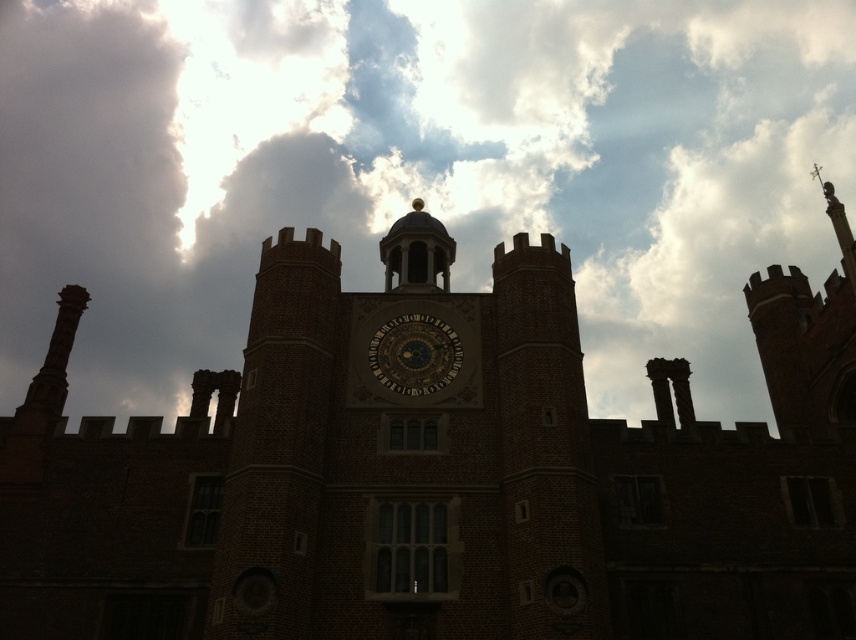
Question: Does brick clock tower at center have a larger size compared to gold metallic clock at center?

Choices:
 (A) yes
 (B) no

Answer: (A)

Question: Considering the real-world distances, which object is farthest from the white fluffy cloud at upper center?

Choices:
 (A) gold metallic clock at center
 (B) brick clock tower at center

Answer: (A)

Question: Which point is closer to the camera taking this photo?

Choices:
 (A) (401, 317)
 (B) (428, 570)
 (C) (694, 74)

Answer: (B)

Question: Is white fluffy cloud at upper center to the right of brick clock tower at center from the viewer's perspective?

Choices:
 (A) no
 (B) yes

Answer: (A)

Question: Can you confirm if white fluffy cloud at upper center is positioned above gold metallic clock at center?

Choices:
 (A) yes
 (B) no

Answer: (A)

Question: Among these objects, which one is nearest to the camera?

Choices:
 (A) white fluffy cloud at upper center
 (B) brick clock tower at center
 (C) gold metallic clock at center

Answer: (B)